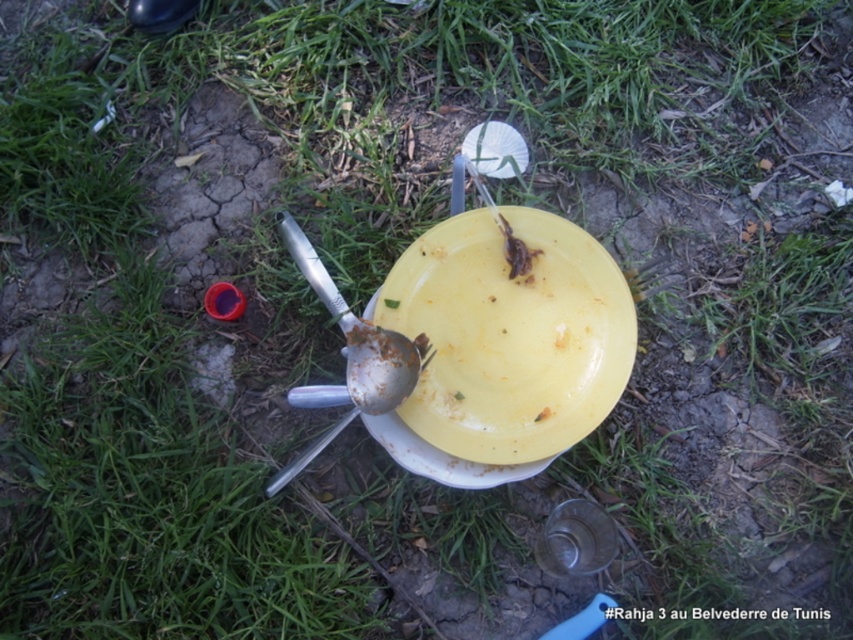
You are a person who just finished eating and wants to place the silver metallic spoon at center into the yellow matte plate at center. Can you do this without moving the plate?

The silver metallic spoon at center is behind the yellow matte plate at center, so you can place the spoon into the plate without moving it by reaching around the front of the plate.

From the picture: You are a person with a 6 inch long hand. You want to pick up both the yellow matte plate at center and the silver metallic spoon at center from the ground. Can you reach both items without moving your hand from its current position?

The yellow matte plate at center and the silver metallic spoon at center are 6.19 inches apart. Since your hand is 6 inches long, you cannot reach both items simultaneously without moving your hand because the distance between them exceeds your hand length.

You are setting up a picnic and have a small container that can only hold items smaller than the yellow matte plate at center. Can you fit the silver metallic spoon at center into the container?

The yellow matte plate at center is bigger than the silver metallic spoon at center, so the spoon is smaller and can fit into the container.